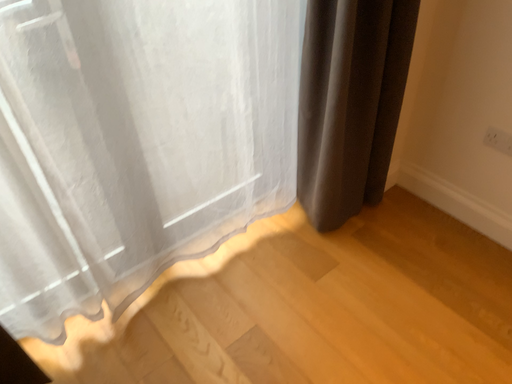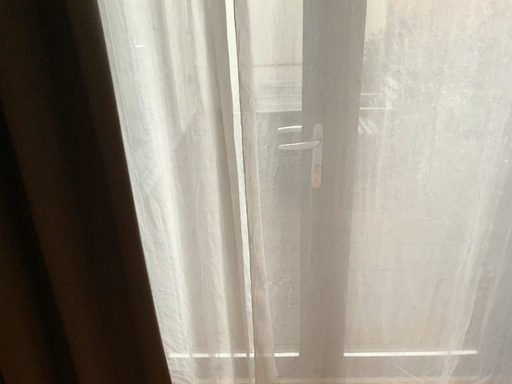
Question: Which way did the camera rotate in the video?

Choices:
 (A) rotated left
 (B) rotated right

Answer: (A)